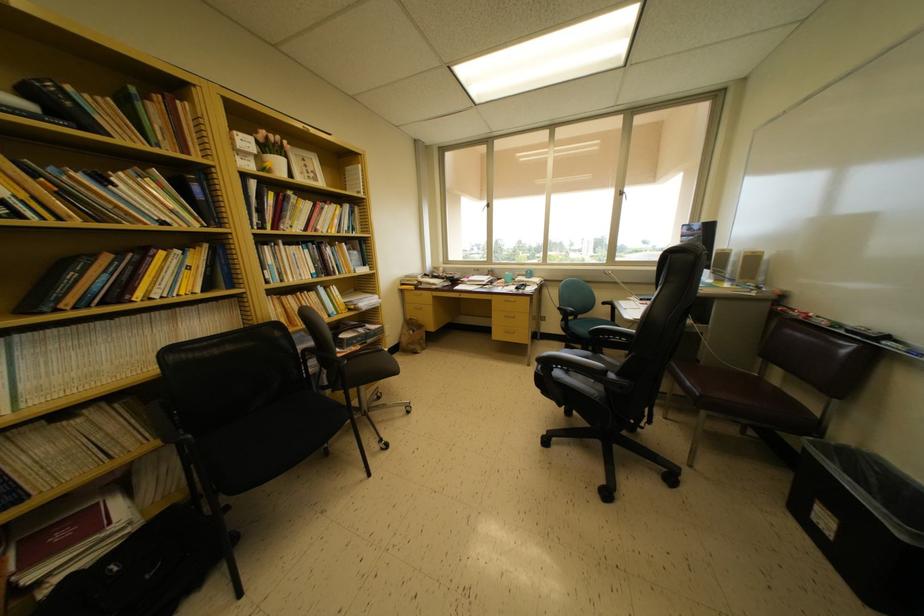
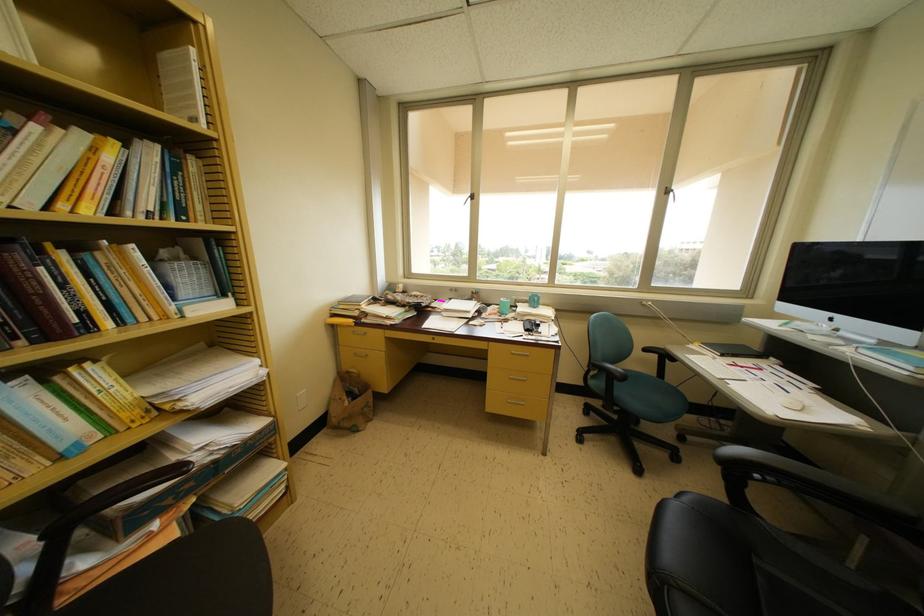
Find the pixel in the second image that matches point 354,249 in the first image.

(181, 253)